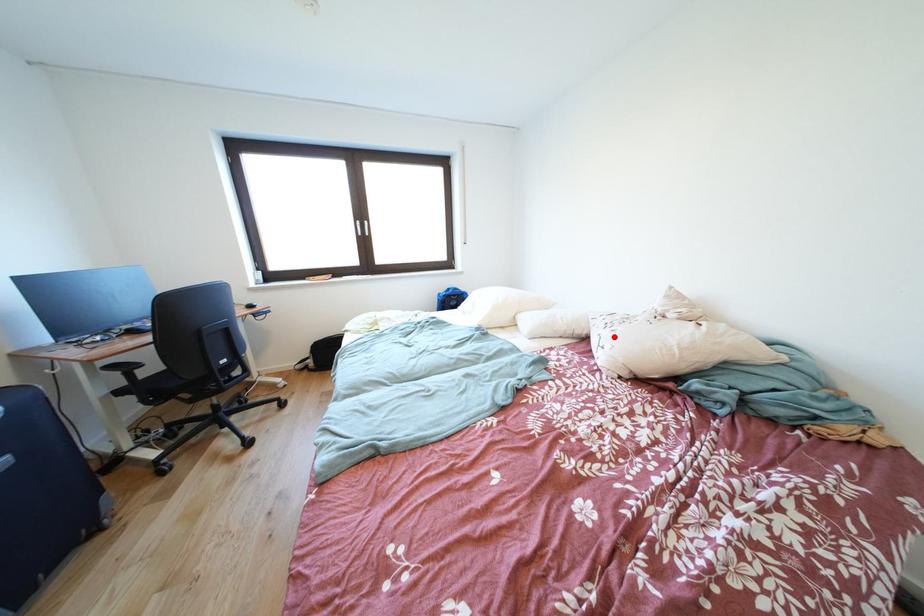
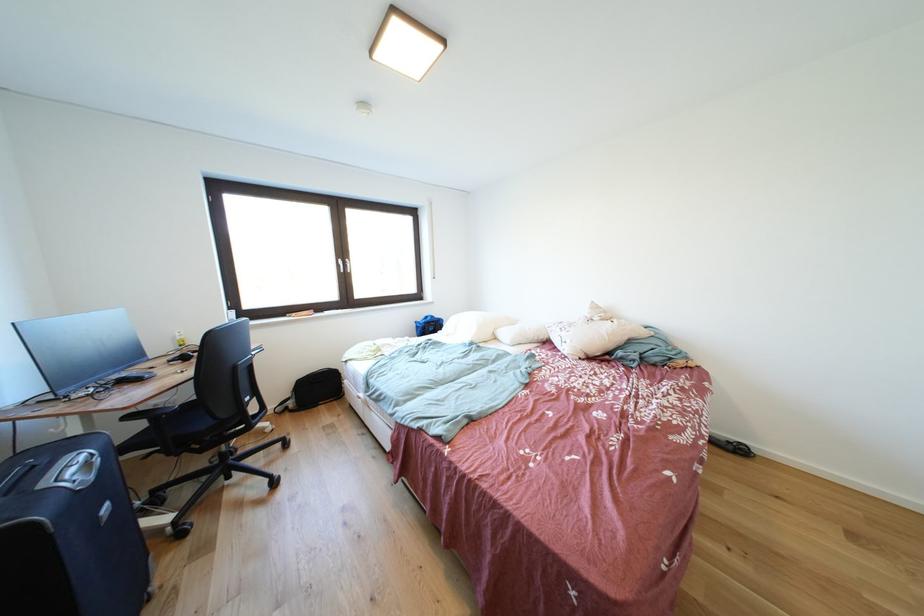
The point at the highlighted location is marked in the first image. Where is the corresponding point in the second image?

(572, 338)